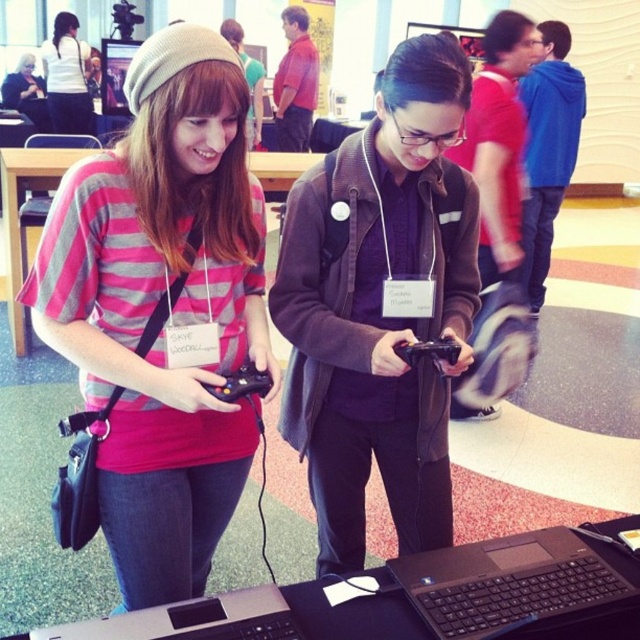
Question: Which is farther from the black matte laptop at lower center?

Choices:
 (A) matte pink shirt at center
 (B) dark brown jacket at center
 (C) matte pink striped shirt at center

Answer: (A)

Question: Is matte pink striped shirt at center below dark brown jacket at center?

Choices:
 (A) no
 (B) yes

Answer: (B)

Question: Where is dark brown jacket at center located in relation to black matte laptop at lower center in the image?

Choices:
 (A) below
 (B) above

Answer: (B)

Question: Is matte pink striped shirt at center below black matte laptop at lower center?

Choices:
 (A) no
 (B) yes

Answer: (A)

Question: Among these points, which one is nearest to the camera?

Choices:
 (A) (88, 93)
 (B) (604, 593)
 (C) (378, 456)
 (D) (163, 116)

Answer: (B)

Question: Which of the following is the closest to the observer?

Choices:
 (A) (65, 52)
 (B) (230, 413)
 (C) (572, 548)

Answer: (C)